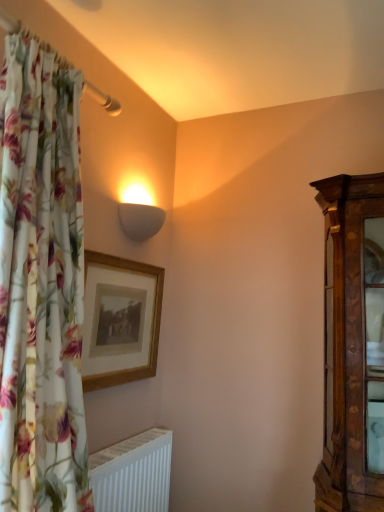
Question: Is wooden picture frame at upper center outside of white matte wall sconce at upper center?

Choices:
 (A) no
 (B) yes

Answer: (B)

Question: Is wooden picture frame at upper center positioned behind white matte wall sconce at upper center?

Choices:
 (A) yes
 (B) no

Answer: (B)

Question: From a real-world perspective, is wooden picture frame at upper center over white matte wall sconce at upper center?

Choices:
 (A) yes
 (B) no

Answer: (B)

Question: From the image's perspective, would you say wooden picture frame at upper center is shown under white matte wall sconce at upper center?

Choices:
 (A) yes
 (B) no

Answer: (A)

Question: Can you confirm if wooden picture frame at upper center is thinner than white matte wall sconce at upper center?

Choices:
 (A) yes
 (B) no

Answer: (A)

Question: Is wooden picture frame at upper center at the left side of white matte wall sconce at upper center?

Choices:
 (A) no
 (B) yes

Answer: (B)

Question: Is wooden picture frame at upper center next to white matte radiator at lower left?

Choices:
 (A) no
 (B) yes

Answer: (A)

Question: Considering the relative sizes of wooden picture frame at upper center and white matte radiator at lower left in the image provided, is wooden picture frame at upper center taller than white matte radiator at lower left?

Choices:
 (A) no
 (B) yes

Answer: (B)

Question: Is wooden picture frame at upper center closer to camera compared to white matte radiator at lower left?

Choices:
 (A) no
 (B) yes

Answer: (A)

Question: From a real-world perspective, is wooden picture frame at upper center under white matte radiator at lower left?

Choices:
 (A) yes
 (B) no

Answer: (B)

Question: Is wooden picture frame at upper center behind white matte radiator at lower left?

Choices:
 (A) no
 (B) yes

Answer: (B)

Question: Is wooden picture frame at upper center shorter than white matte radiator at lower left?

Choices:
 (A) yes
 (B) no

Answer: (B)

Question: Can you see white matte radiator at lower left touching wooden picture frame at upper center?

Choices:
 (A) yes
 (B) no

Answer: (B)